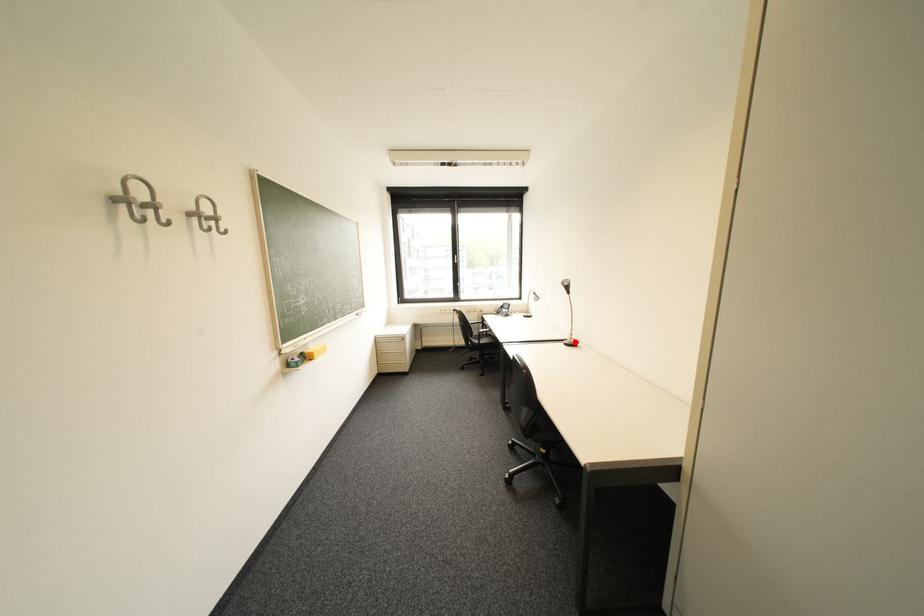
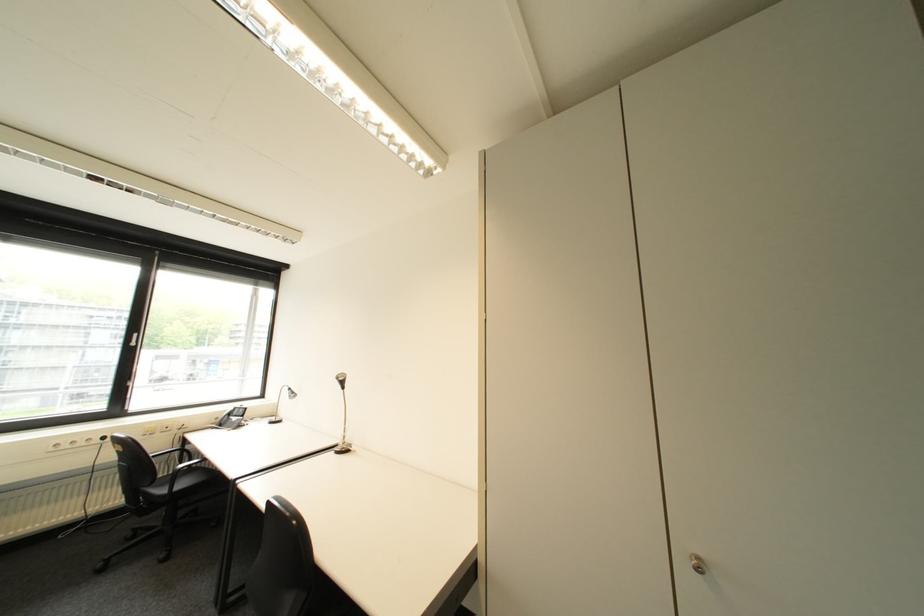
Question: I am providing you with two images of the same scene from different viewpoints. A red point is shown in image1. For the corresponding object point in image2, is it positioned nearer or farther from the camera?

Choices:
 (A) Nearer
 (B) Farther

Answer: (B)